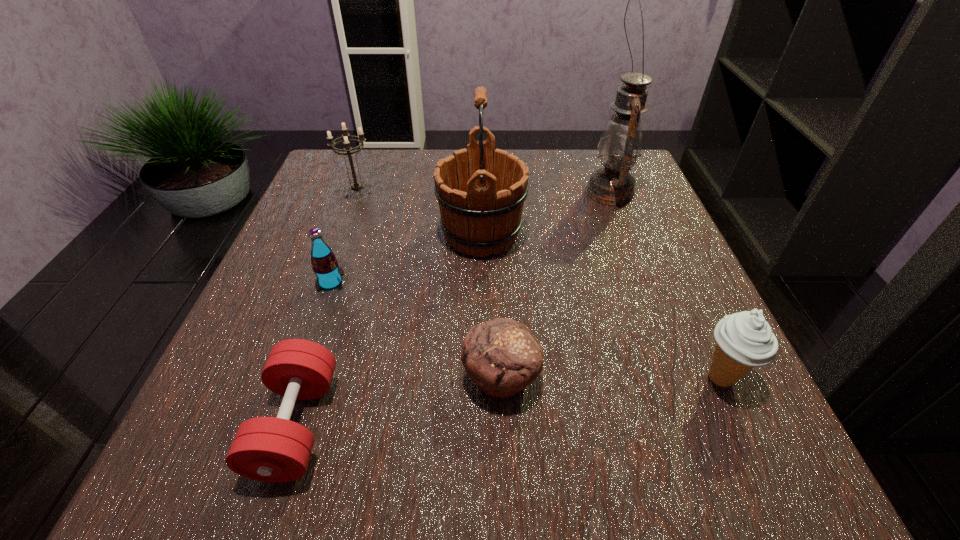
Locate an element on the screen. vacant area situated 0.070m on the front of the icecream is located at coordinates (754, 451).

In order to click on free space located on the back of the fourth nearest object in this screenshot , I will do `click(345, 242)`.

You are a GUI agent. You are given a task and a screenshot of the screen. Output one action in this format:
    pyautogui.click(x=<x>, y=<y>)
    Task: Click on the vacant space situated 0.360m on the left of the muffin
    Image resolution: width=960 pixels, height=540 pixels.
    Given the screenshot: What is the action you would take?
    pyautogui.click(x=219, y=377)

Identify the location of vacant point located on the right of the dumbbell. (543, 424).

In order to click on oil lamp located in the far edge section of the desktop in this screenshot , I will do click(620, 145).

Locate an element on the screen. This screenshot has height=540, width=960. candle holder located in the far edge section of the desktop is located at coordinates (356, 186).

The height and width of the screenshot is (540, 960). Find the location of `object present at the near edge`. object present at the near edge is located at coordinates (269, 449).

Find the location of a particular element. candle holder present at the left edge is located at coordinates (356, 186).

This screenshot has width=960, height=540. I want to click on soda located at the left edge, so click(x=329, y=275).

Find the location of a particular element. dumbbell located in the left edge section of the desktop is located at coordinates (269, 449).